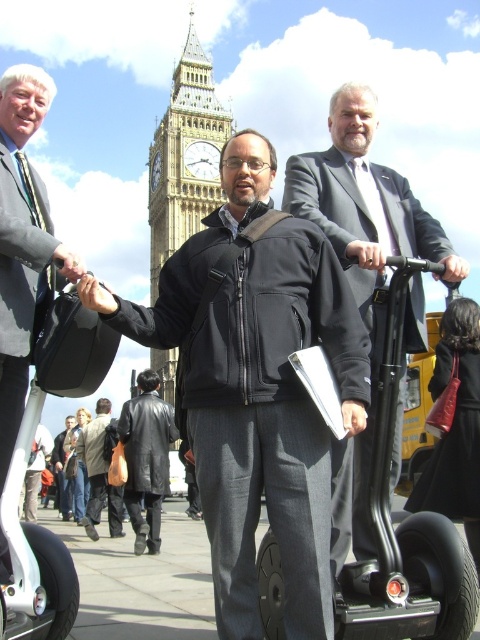
Is point (367, 548) positioned before point (128, 465)?

Yes, point (367, 548) is closer to viewer.

Can you confirm if dark gray suit at center is taller than leather jacket at center?

Correct, dark gray suit at center is much taller as leather jacket at center.

Find the location of a particular element. The width and height of the screenshot is (480, 640). dark gray suit at center is located at coordinates (361, 268).

The image size is (480, 640). I want to click on black softshell jacket at center, so click(256, 388).

Which is below, black softshell jacket at center or light gray suit at left?

black softshell jacket at center is below.

Is point (295, 580) behind point (10, 307)?

No, (295, 580) is in front of (10, 307).

What are the coordinates of `black softshell jacket at center` in the screenshot? It's located at (256, 388).

Does dark gray suit at center have a smaller size compared to golden stone clock tower at center?

Yes.

Who is positioned more to the left, dark gray suit at center or golden stone clock tower at center?

From the viewer's perspective, golden stone clock tower at center appears more on the left side.

Is point (284, 192) more distant than point (169, 349)?

No, it is not.

Where is `dark gray suit at center`? The width and height of the screenshot is (480, 640). dark gray suit at center is located at coordinates (361, 268).